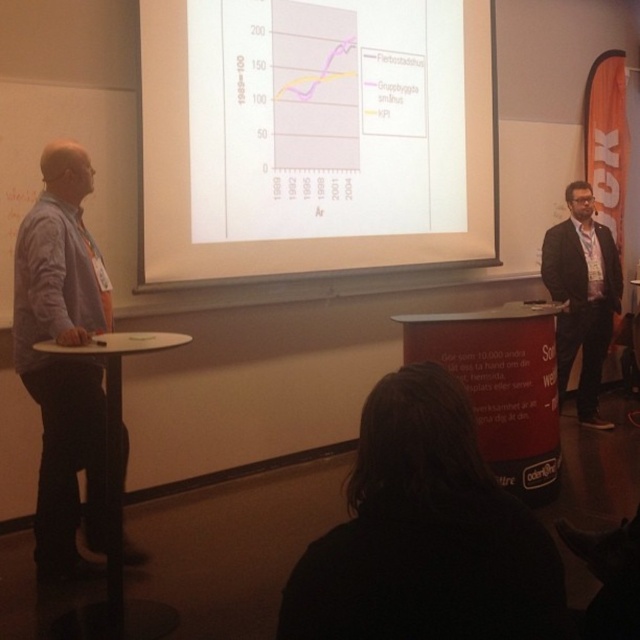
You are an attendee at the presentation. You notice two items in the front of the room. One is the black fabric at lower center and the other is the blue shirt at left. Which item is narrower when viewed from the front?

The black fabric at lower center is narrower than the blue shirt at left because it is described as thinner.

You are an attendee at the presentation and you want to see both the white paper at center and the blue shirt at left clearly. Which one is closer to the screen?

The white paper at center is closer to the screen than the blue shirt at left because it is positioned at the center, while the blue shirt at left is located on the left side of the image.